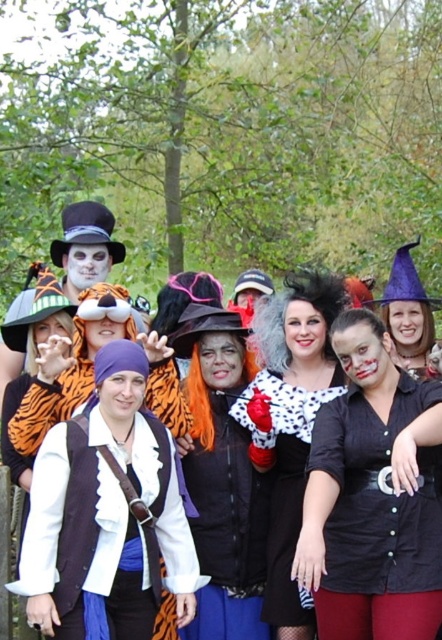
From the picture: Is matte black shirt at center taller than polka dot blouse at center?

In fact, matte black shirt at center may be shorter than polka dot blouse at center.

Who is positioned more to the left, matte black shirt at center or polka dot blouse at center?

Positioned to the left is polka dot blouse at center.

Which is behind, point (372, 544) or point (273, 300)?

Positioned behind is point (273, 300).

Find the location of `matte black shirt at center`. matte black shirt at center is located at coordinates (372, 497).

Who is higher up, orange wig at center or polka dot blouse at center?

polka dot blouse at center

Who is more distant from viewer, (209, 358) or (324, 352)?

The point (209, 358) is more distant.

Identify the location of orange wig at center. (221, 480).

Is orange wig at center behind orange tiger costume at center?

No, it is in front of orange tiger costume at center.

Is orange wig at center bigger than orange tiger costume at center?

Correct, orange wig at center is larger in size than orange tiger costume at center.

The height and width of the screenshot is (640, 442). I want to click on orange wig at center, so click(x=221, y=480).

What are the coordinates of `orange wig at center` in the screenshot? It's located at (221, 480).